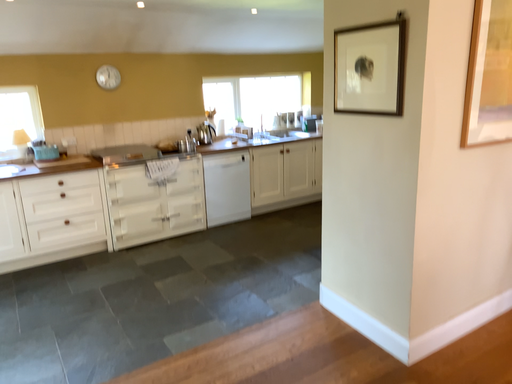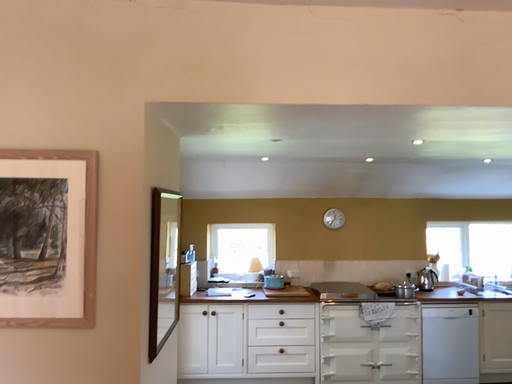
Question: Which way did the camera rotate in the video?

Choices:
 (A) rotated upward
 (B) rotated downward

Answer: (A)